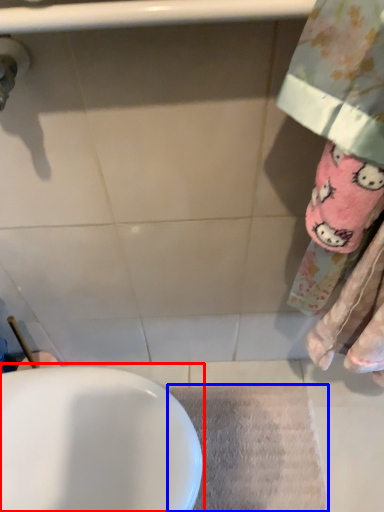
Question: Which object is closer to the camera taking this photo, sink (highlighted by a red box) or bath mat (highlighted by a blue box)?

Choices:
 (A) sink
 (B) bath mat

Answer: (A)